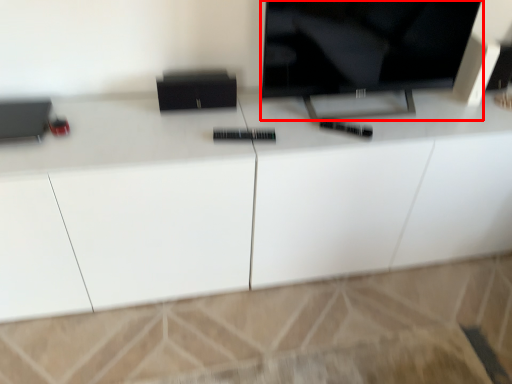
Question: From the image's perspective, what is the correct spatial positioning of television (annotated by the red box) in reference to cabinetry?

Choices:
 (A) below
 (B) above

Answer: (B)